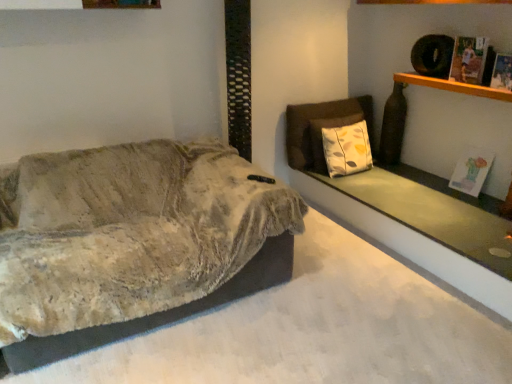
Question: In terms of height, does printed paper magazine at upper right, arranged as the 2th magazine when viewed from the front, look taller or shorter compared to textured beige blanket at left?

Choices:
 (A) short
 (B) tall

Answer: (A)

Question: Considering the positions of point (466, 59) and point (202, 243), is point (466, 59) closer or farther from the camera than point (202, 243)?

Choices:
 (A) farther
 (B) closer

Answer: (A)

Question: Based on their relative distances, which object is farther from the printed paper magazine at upper right, arranged as the second magazine when viewed from the back?

Choices:
 (A) wooden shelf at upper right
 (B) printed paper magazine at upper right, which is the third magazine in back-to-front order
 (C) matte paper magazine at upper right, arranged as the third magazine when viewed from the top
 (D) textured beige blanket at left
 (E) smooth concrete ledge at upper right

Answer: (D)

Question: Which object is positioned farthest from the textured beige blanket at left?

Choices:
 (A) matte paper magazine at upper right, the 1th magazine viewed from the back
 (B) smooth concrete ledge at upper right
 (C) wooden shelf at upper right
 (D) printed paper magazine at upper right, positioned as the second magazine in top-to-bottom order
 (E) printed paper magazine at upper right, arranged as the second magazine when viewed from the back

Answer: (D)